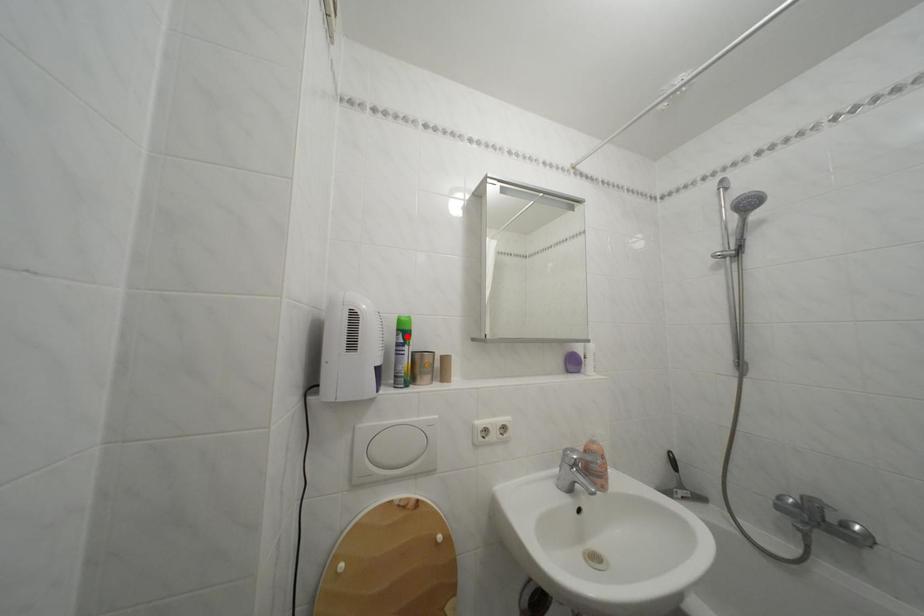
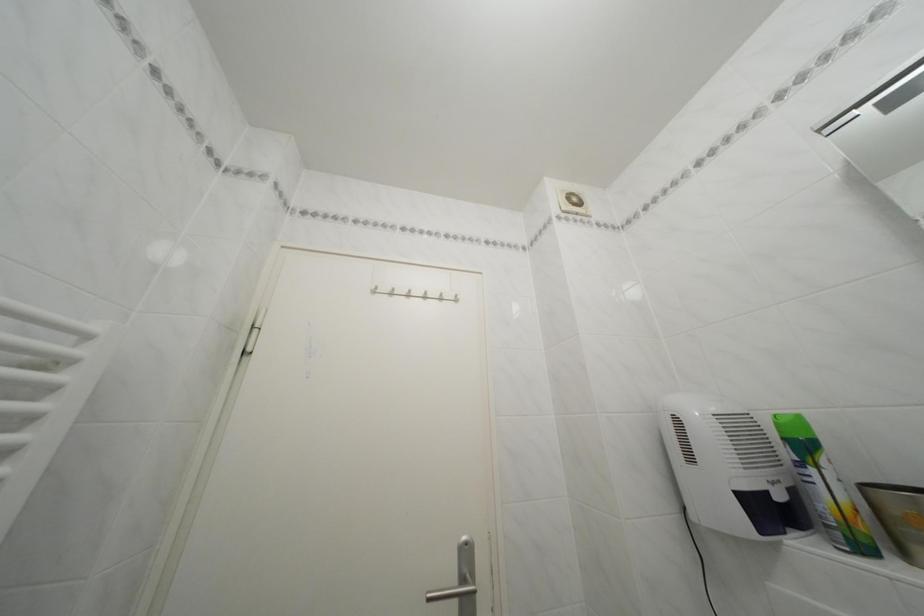
The point at the highlighted location is marked in the first image. Where is the corresponding point in the second image?

(793, 445)